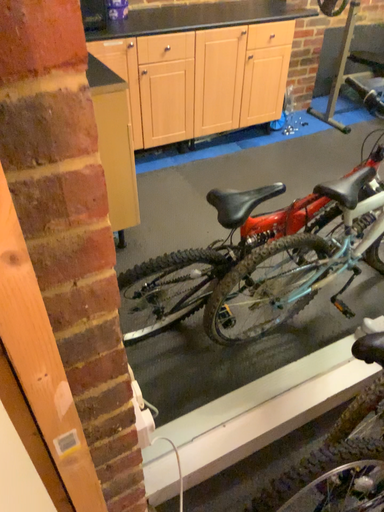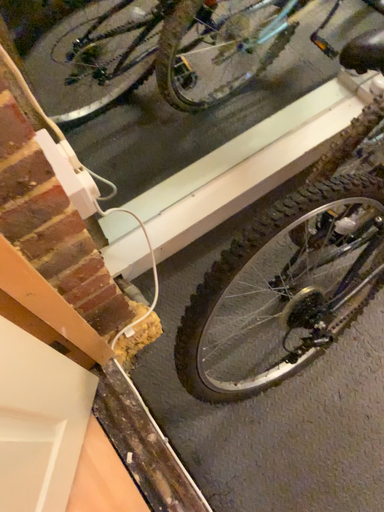
Question: How did the camera likely rotate when shooting the video?

Choices:
 (A) rotated downward
 (B) rotated upward

Answer: (A)